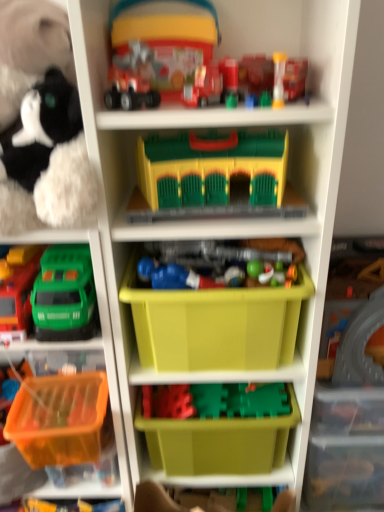
Question: From the image's perspective, is translucent plastic cup at upper center, which is the fourth toy in top-to-bottom order, above translucent orange plastic basket at lower left, acting as the third storage box starting from the top?

Choices:
 (A) no
 (B) yes

Answer: (B)

Question: Can you confirm if translucent plastic cup at upper center, which is the fourth toy in top-to-bottom order, is positioned to the right of translucent orange plastic basket at lower left, positioned as the first storage box in bottom-to-top order?

Choices:
 (A) yes
 (B) no

Answer: (A)

Question: Is translucent plastic cup at upper center, which is counted as the 6th toy, starting from the bottom, at the left side of translucent orange plastic basket at lower left, positioned as the first storage box in bottom-to-top order?

Choices:
 (A) yes
 (B) no

Answer: (B)

Question: Is translucent plastic cup at upper center, which is counted as the 6th toy, starting from the bottom, not close to translucent orange plastic basket at lower left, acting as the third storage box starting from the top?

Choices:
 (A) yes
 (B) no

Answer: (B)

Question: Does translucent plastic cup at upper center, which is the fourth toy in top-to-bottom order, have a larger size compared to translucent orange plastic basket at lower left, positioned as the first storage box in bottom-to-top order?

Choices:
 (A) yes
 (B) no

Answer: (B)

Question: From the image's perspective, relative to translucent orange plastic container at lower left, positioned as the ninth toy in top-to-bottom order, is green plastic storage box at lower center, arranged as the second storage box when viewed from the top, above or below?

Choices:
 (A) above
 (B) below

Answer: (A)

Question: Looking at the image, does green plastic storage box at lower center, which is the 2th storage box in bottom-to-top order, seem bigger or smaller compared to translucent orange plastic container at lower left, marked as the first toy in a bottom-to-top arrangement?

Choices:
 (A) small
 (B) big

Answer: (B)

Question: From a real-world perspective, relative to translucent orange plastic container at lower left, marked as the first toy in a bottom-to-top arrangement, is green plastic storage box at lower center, which is the 2th storage box in bottom-to-top order, vertically above or below?

Choices:
 (A) below
 (B) above

Answer: (A)

Question: In the image, is green plastic storage box at lower center, which is the 2th storage box in bottom-to-top order, on the left side or the right side of translucent orange plastic container at lower left, marked as the first toy in a bottom-to-top arrangement?

Choices:
 (A) right
 (B) left

Answer: (A)

Question: In terms of size, does matte plastic toy truck at upper center, which appears as the 1th toy when viewed from the top, appear bigger or smaller than green plastic toy truck at left, the 2th toy ordered from the bottom?

Choices:
 (A) small
 (B) big

Answer: (A)

Question: Considering their positions, is matte plastic toy truck at upper center, arranged as the 9th toy when ordered from the bottom, located in front of or behind green plastic toy truck at left, the 2th toy ordered from the bottom?

Choices:
 (A) front
 (B) behind

Answer: (A)

Question: From the image's perspective, is matte plastic toy truck at upper center, which appears as the 1th toy when viewed from the top, above or below green plastic toy truck at left, which is the eighth toy in top-to-bottom order?

Choices:
 (A) above
 (B) below

Answer: (A)

Question: From their relative heights in the image, would you say matte plastic toy truck at upper center, which appears as the 1th toy when viewed from the top, is taller or shorter than green plastic toy truck at left, the 2th toy ordered from the bottom?

Choices:
 (A) short
 (B) tall

Answer: (B)

Question: Visually, is translucent plastic toy at upper center, placed as the 2th toy when sorted from top to bottom, positioned to the left or to the right of green plastic storage box at lower center, arranged as the second storage box when viewed from the top?

Choices:
 (A) left
 (B) right

Answer: (B)

Question: Is translucent plastic toy at upper center, which is the eighth toy from bottom to top, wider or thinner than green plastic storage box at lower center, which is the 2th storage box in bottom-to-top order?

Choices:
 (A) thin
 (B) wide

Answer: (A)